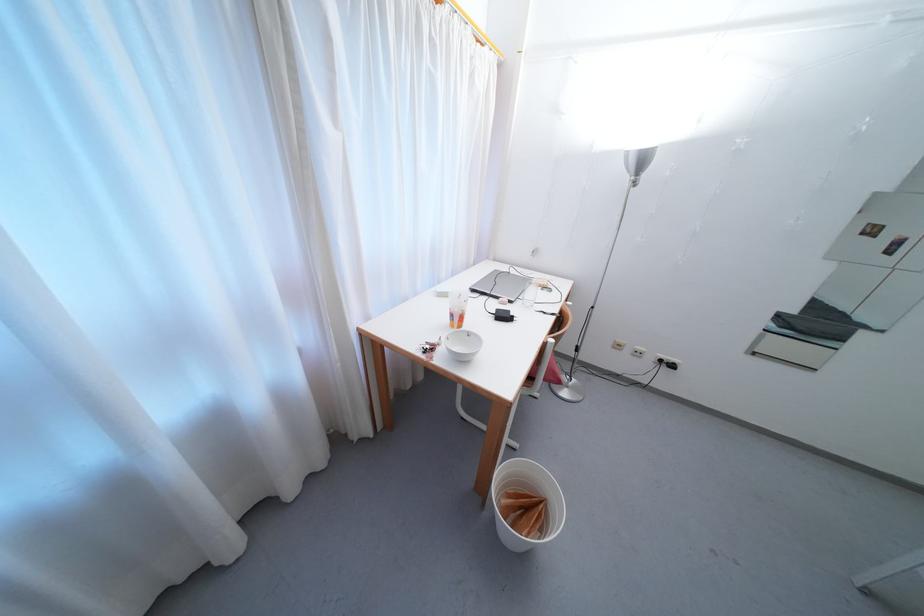
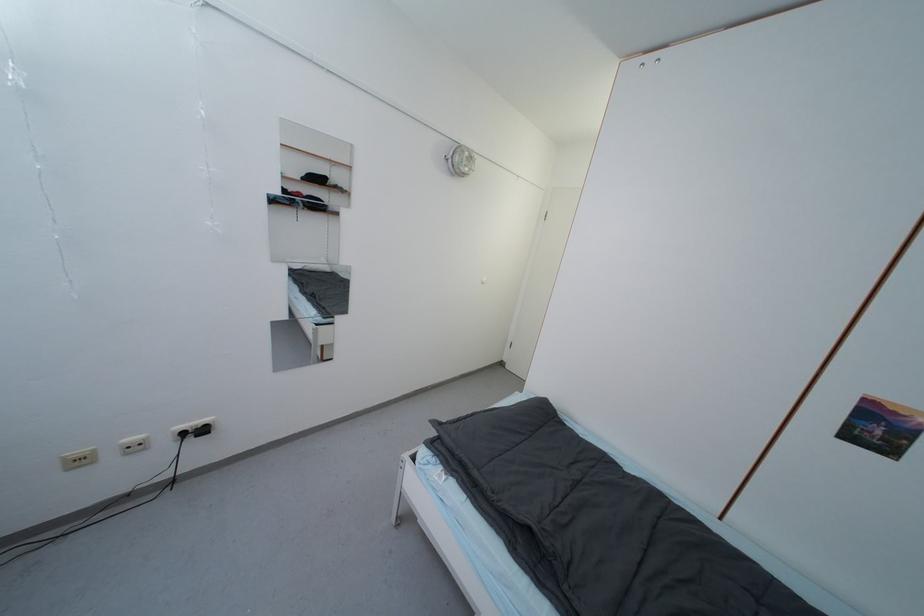
Where in the second image is the point corresponding to (641,357) from the first image?

(140, 450)